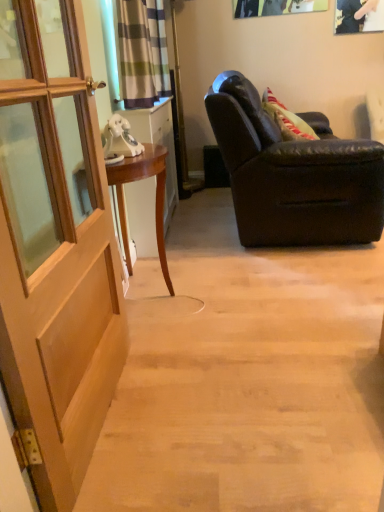
Question: Would you say striped fabric curtain at upper center is inside or outside velvet-like green pillow at right?

Choices:
 (A) outside
 (B) inside

Answer: (A)

Question: In the image, is striped fabric curtain at upper center on the left side or the right side of velvet-like green pillow at right?

Choices:
 (A) left
 (B) right

Answer: (A)

Question: Estimate the real-world distances between objects in this image. Which object is farther from the metallic silver picture frame at upper right?

Choices:
 (A) light brown wood door at left
 (B) matte white cabinet at left
 (C) matte black leather armchair at right
 (D) striped fabric curtain at upper center
 (E) mahogany wood desk at left

Answer: (A)

Question: Which object is positioned closest to the mahogany wood desk at left?

Choices:
 (A) metallic silver picture frame at upper right
 (B) striped fabric curtain at upper center
 (C) matte white cabinet at left
 (D) light brown wood door at left
 (E) matte black leather armchair at right

Answer: (C)